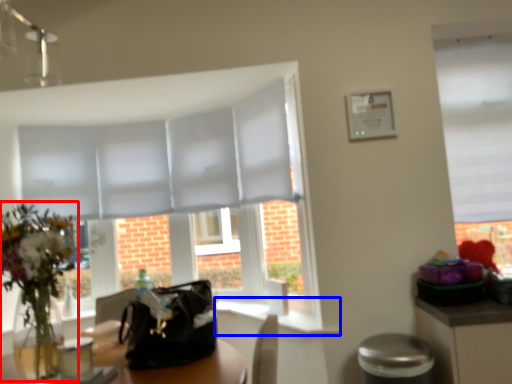
Question: Which object is further to the camera taking this photo, floral arrangement (highlighted by a red box) or window sill (highlighted by a blue box)?

Choices:
 (A) floral arrangement
 (B) window sill

Answer: (B)